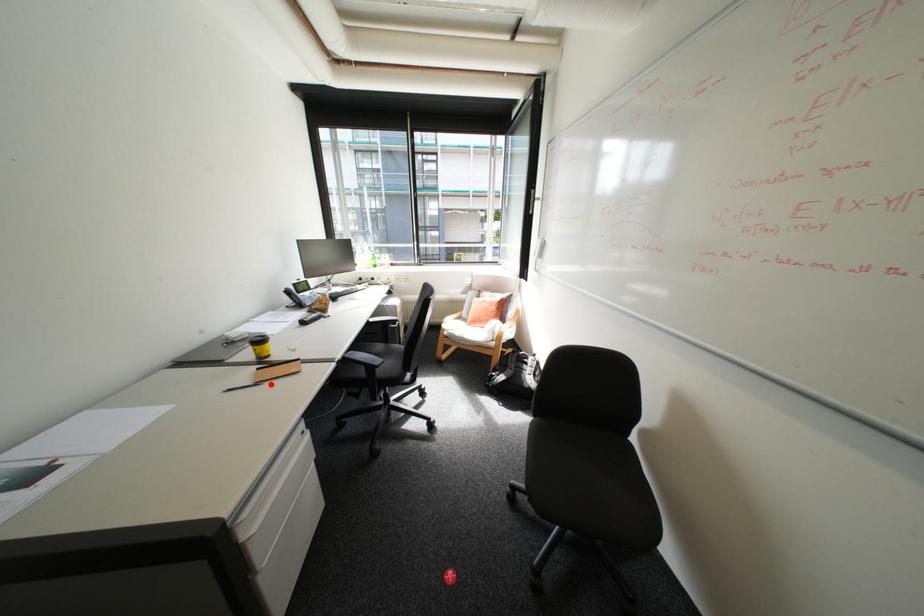
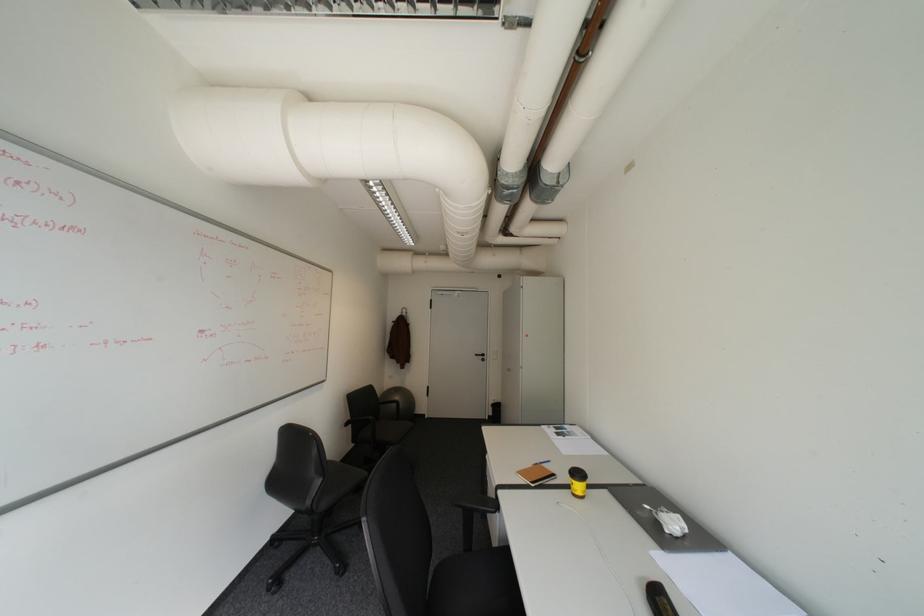
Question: I am providing you with two images of the same scene from different viewpoints. A red point is marked on the first image. Can you still see the location of the red point in image 2?

Choices:
 (A) Yes
 (B) No

Answer: (A)